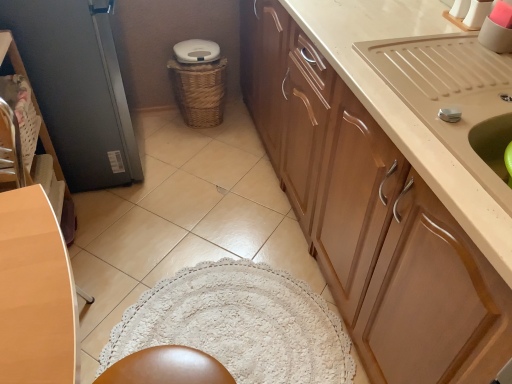
This screenshot has width=512, height=384. What do you see at coordinates (11, 144) in the screenshot? I see `matte brown chair at left` at bounding box center [11, 144].

The height and width of the screenshot is (384, 512). What do you see at coordinates (77, 87) in the screenshot?
I see `metallic gray screen door at left` at bounding box center [77, 87].

Where is `beige glossy sink at upper right`? This screenshot has width=512, height=384. beige glossy sink at upper right is located at coordinates (454, 97).

Where is `matte brown chair at left`? Image resolution: width=512 pixels, height=384 pixels. matte brown chair at left is located at coordinates (11, 144).

Considering the sizes of objects metallic gray screen door at left and woven brown basket at center in the image provided, who is taller, metallic gray screen door at left or woven brown basket at center?

metallic gray screen door at left is taller.

Is metallic gray screen door at left further to the viewer compared to woven brown basket at center?

No, metallic gray screen door at left is in front of woven brown basket at center.

Could you tell me if metallic gray screen door at left is turned towards woven brown basket at center?

Yes, metallic gray screen door at left is aimed at woven brown basket at center.

Is woven brown basket at center at the right side of wooden cabinet at upper right?

Incorrect, woven brown basket at center is not on the right side of wooden cabinet at upper right.

Can you confirm if woven brown basket at center is shorter than wooden cabinet at upper right?

Indeed, woven brown basket at center has a lesser height compared to wooden cabinet at upper right.

Locate an element on the screen. This screenshot has height=384, width=512. basket behind the wooden cabinet at upper right is located at coordinates (199, 91).

From the image's perspective, relative to wooden cabinet at upper right, is woven brown basket at center above or below?

woven brown basket at center is above wooden cabinet at upper right.

Which object is wider, wooden cabinet at upper right or woven brown basket at center?

wooden cabinet at upper right.

Which object is positioned more to the left, wooden cabinet at upper right or woven brown basket at center?

Positioned to the left is woven brown basket at center.

The height and width of the screenshot is (384, 512). Identify the location of basket above the wooden cabinet at upper right (from the image's perspective). 199,91.

Is wooden cabinet at upper right far away from woven brown basket at center?

No, wooden cabinet at upper right is not far away from woven brown basket at center.

From a real-world perspective, is beige glossy sink at upper right positioned over matte brown chair at left based on gravity?

Correct, in the physical world, beige glossy sink at upper right is higher than matte brown chair at left.

From the image's perspective, is beige glossy sink at upper right on matte brown chair at left?

Correct, beige glossy sink at upper right appears higher than matte brown chair at left in the image.

Which is farther from the camera, [463,110] or [18,147]?

The point [18,147] is behind.

Is metallic gray screen door at left not inside matte brown chair at left?

Absolutely, metallic gray screen door at left is external to matte brown chair at left.

From the image's perspective, who appears lower, metallic gray screen door at left or matte brown chair at left?

matte brown chair at left appears lower in the image.

Is point (28, 34) behind point (6, 162)?

That is True.

From a real-world perspective, between metallic gray screen door at left and matte brown chair at left, who is vertically lower?

matte brown chair at left is physically lower.

Considering the relative positions of woven brown basket at center and metallic gray screen door at left in the image provided, is woven brown basket at center to the left or to the right of metallic gray screen door at left?

Based on their positions, woven brown basket at center is located to the right of metallic gray screen door at left.

Which of these two, woven brown basket at center or metallic gray screen door at left, stands shorter?

With less height is woven brown basket at center.

From a real-world perspective, is woven brown basket at center located beneath metallic gray screen door at left?

Yes, from a real-world perspective, woven brown basket at center is below metallic gray screen door at left.

Can we say woven brown basket at center lies outside metallic gray screen door at left?

woven brown basket at center lies outside metallic gray screen door at left's area.

From a real-world perspective, is matte brown chair at left under woven brown basket at center?

Incorrect, from a real-world perspective, matte brown chair at left is higher than woven brown basket at center.

Is woven brown basket at center at the back of matte brown chair at left?

matte brown chair at left does not have its back to woven brown basket at center.

Is matte brown chair at left in contact with woven brown basket at center?

matte brown chair at left is not next to woven brown basket at center, and they're not touching.

Locate an element on the screen. screen door lying below the woven brown basket at center (from the image's perspective) is located at coordinates (77, 87).

Where is `cabinetry on the right of woven brown basket at center`? cabinetry on the right of woven brown basket at center is located at coordinates (371, 218).

Consider the image. Estimate the real-world distances between objects in this image. Which object is further from wooden cabinet at upper right, metallic gray screen door at left or matte brown chair at left?

The object further to wooden cabinet at upper right is matte brown chair at left.

Estimate the real-world distances between objects in this image. Which object is closer to beige glossy sink at upper right, metallic gray screen door at left or matte brown chair at left?

metallic gray screen door at left is positioned closer to the anchor beige glossy sink at upper right.

Estimate the real-world distances between objects in this image. Which object is further from beige glossy sink at upper right, woven brown basket at center or matte brown chair at left?

woven brown basket at center lies further to beige glossy sink at upper right than the other object.

From the picture: From the image, which object appears to be nearer to wooden cabinet at upper right, matte brown chair at left or metallic gray screen door at left?

Based on the image, metallic gray screen door at left appears to be nearer to wooden cabinet at upper right.

Looking at the image, which one is located closer to matte brown chair at left, metallic gray screen door at left or beige glossy sink at upper right?

→ metallic gray screen door at left.

Based on the photo, which object lies nearer to the anchor point woven brown basket at center, matte brown chair at left or metallic gray screen door at left?

The object closer to woven brown basket at center is metallic gray screen door at left.

Looking at the image, which one is located closer to matte brown chair at left, woven brown basket at center or wooden cabinet at upper right?

woven brown basket at center is closer to matte brown chair at left.

Based on their spatial positions, is wooden cabinet at upper right or matte brown chair at left further from woven brown basket at center?

Based on the image, wooden cabinet at upper right appears to be further to woven brown basket at center.

Find the location of a particular element. cabinetry located between metallic gray screen door at left and beige glossy sink at upper right in the left-right direction is located at coordinates (371, 218).

In order to click on cabinetry between matte brown chair at left and beige glossy sink at upper right from left to right in this screenshot , I will do `click(371, 218)`.

The height and width of the screenshot is (384, 512). In order to click on screen door between wooden cabinet at upper right and woven brown basket at center from front to back in this screenshot , I will do `click(77, 87)`.

You are a GUI agent. You are given a task and a screenshot of the screen. Output one action in this format:
    pyautogui.click(x=<x>, y=<y>)
    Task: Click on the chair between beige glossy sink at upper right and woven brown basket at center along the z-axis
    This screenshot has width=512, height=384.
    Given the screenshot: What is the action you would take?
    pyautogui.click(x=11, y=144)